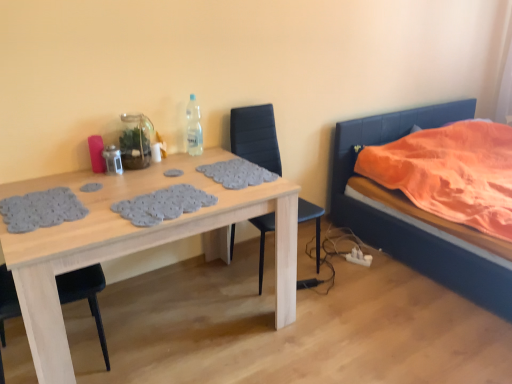
At what (x,y) coordinates should I click in order to perform the action: click on vacant space to the right of black leather chair at center. Please return your answer as a coordinate pair (x, y). Looking at the image, I should click on coord(349,274).